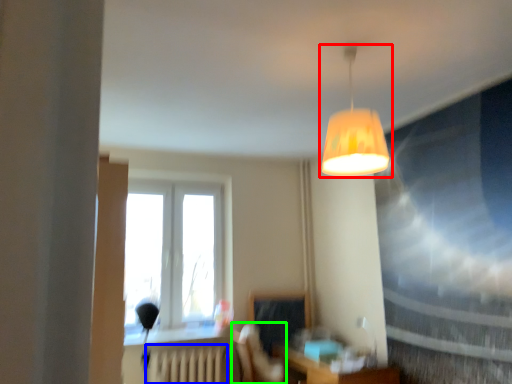
Question: Which object is the farthest from lamp (highlighted by a red box)? Choose among these: radiator (highlighted by a blue box) or swivel chair (highlighted by a green box).

Choices:
 (A) radiator
 (B) swivel chair

Answer: (A)